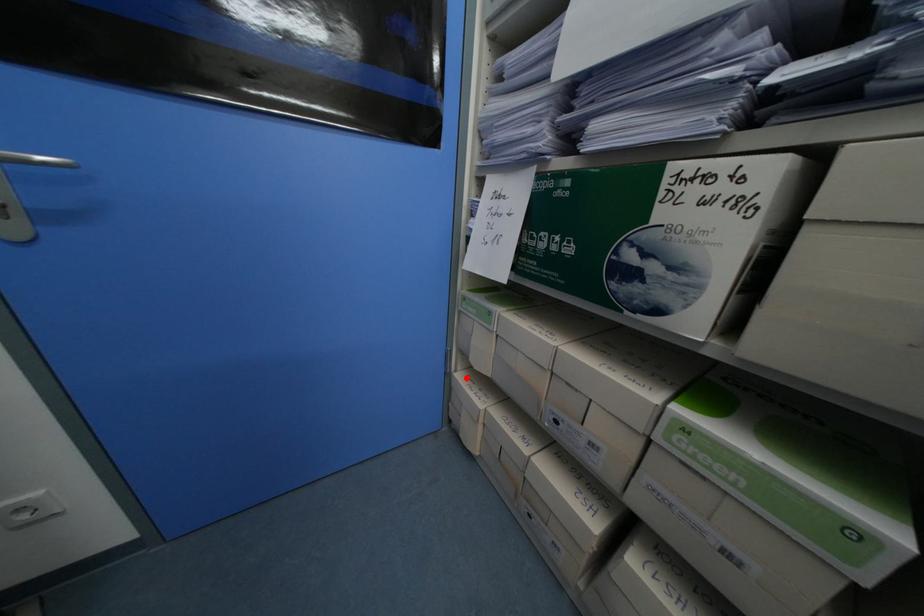
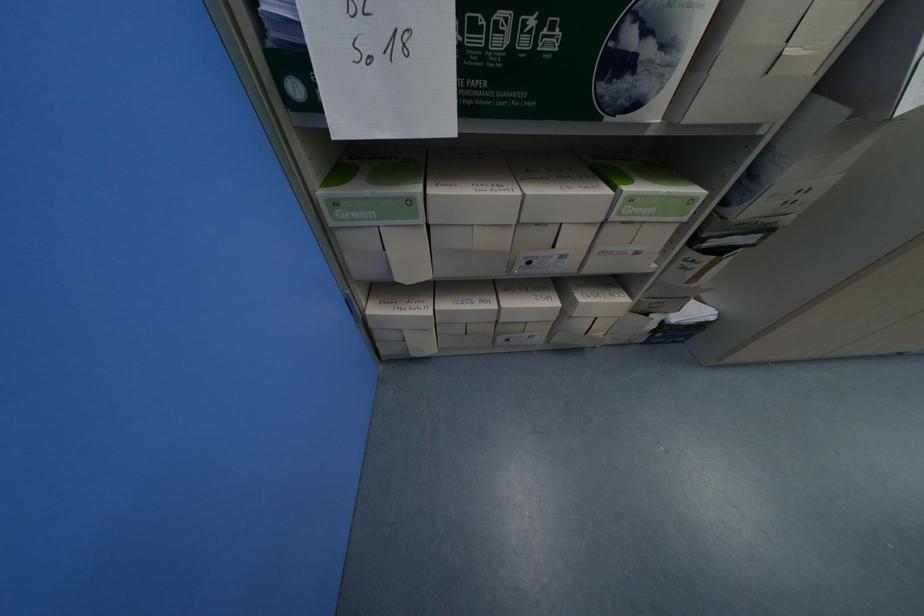
Question: A red point is marked in image1. In image2, is the corresponding 3D point closer to the camera or farther? Reply with the corresponding letter.

Choices:
 (A) The corresponding 3D point is closer.
 (B) The corresponding 3D point is farther.

Answer: (A)